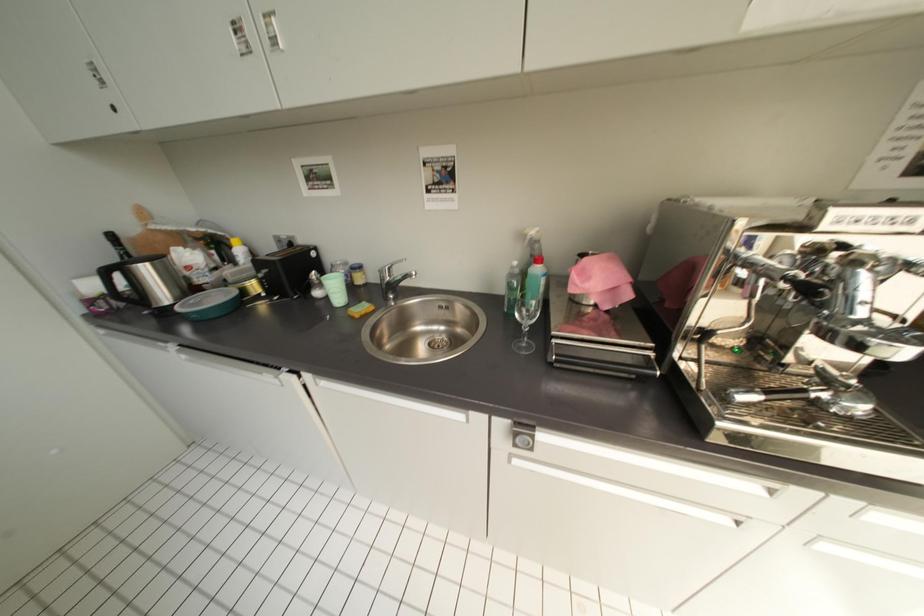
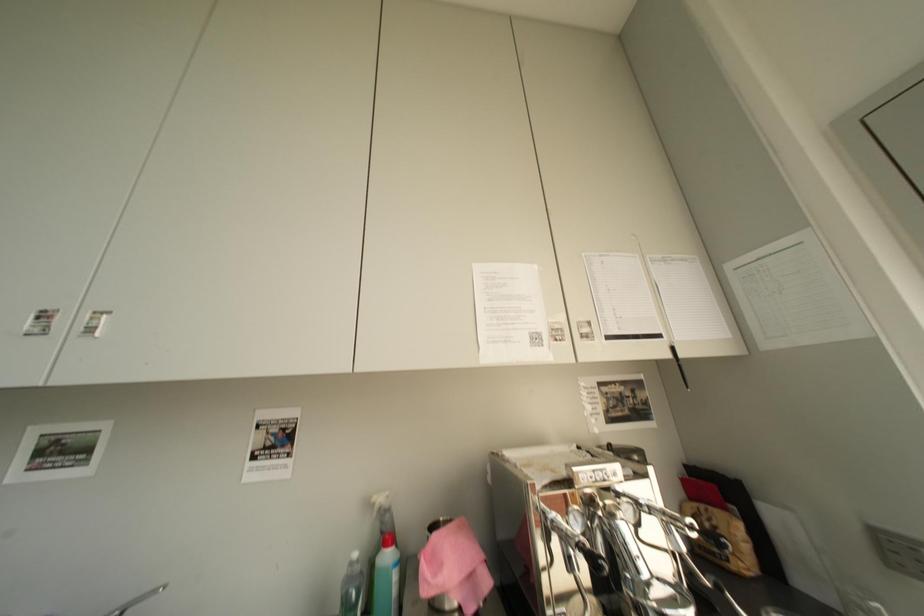
Based on the photo, how did the camera likely rotate?

The camera's rotation is toward right-up.